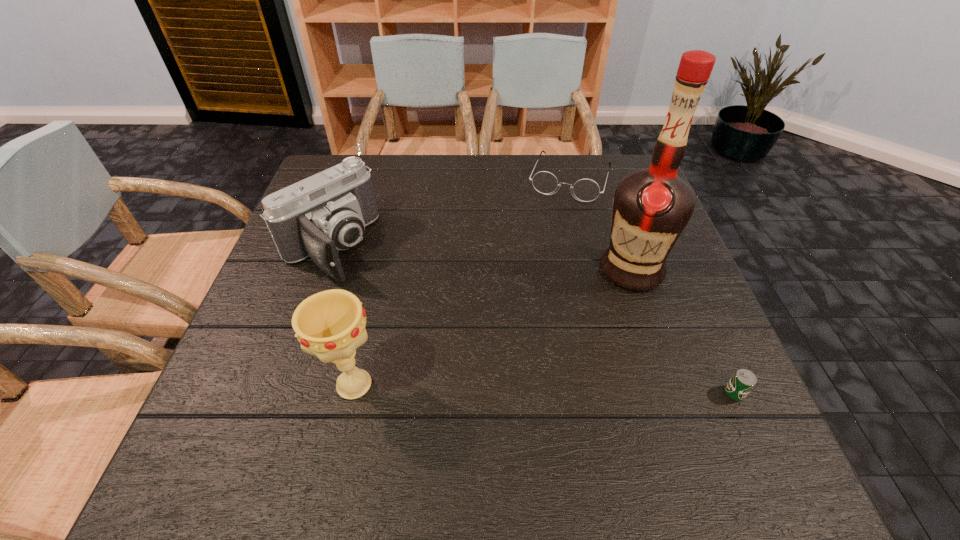
Identify the location of free spot that satisfies the following two spatial constraints: 1. on the front side of the camera; 2. on the left side of the shortest object. click(x=278, y=393).

Image resolution: width=960 pixels, height=540 pixels. Find the location of `vacant space that satisfies the following two spatial constraints: 1. on the back side of the third shortest object; 2. on the right side of the second shortest object`. vacant space that satisfies the following two spatial constraints: 1. on the back side of the third shortest object; 2. on the right side of the second shortest object is located at coordinates (353, 179).

What are the coordinates of `free space in the image that satisfies the following two spatial constraints: 1. on the front side of the chalice; 2. on the left side of the beer can` in the screenshot? It's located at (352, 393).